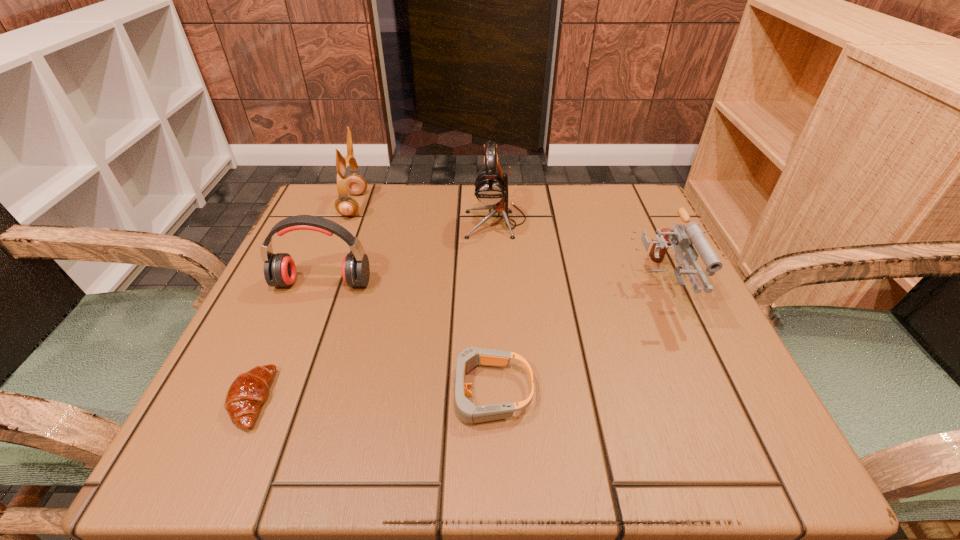
This screenshot has width=960, height=540. Identify the location of the rightmost earphone. (491, 186).

Locate an element on the screen. The image size is (960, 540). the nearest earphone is located at coordinates click(279, 269).

Find the location of a particular element. the rightmost object is located at coordinates (681, 237).

Find the location of `goggles`. goggles is located at coordinates (467, 412).

Identify the location of crescent roll. (249, 390).

You are a GUI agent. You are given a task and a screenshot of the screen. Output one action in this format:
    pyautogui.click(x=<x>, y=<y>)
    Task: Click on the blank space located 0.050m on the back of the rightmost earphone
    The image size is (960, 540).
    Given the screenshot: What is the action you would take?
    pyautogui.click(x=494, y=192)

Identify the location of free space located on the ear cups of the nearest earphone. (278, 395).

Locate an element on the screen. free space located at the barrel end of the rightmost object is located at coordinates (698, 372).

Locate an element on the screen. Image resolution: width=960 pixels, height=540 pixels. free point located on the front and back of the goggles is located at coordinates (272, 392).

Where is `vacant area located on the front and back of the goggles`? The image size is (960, 540). vacant area located on the front and back of the goggles is located at coordinates (251, 392).